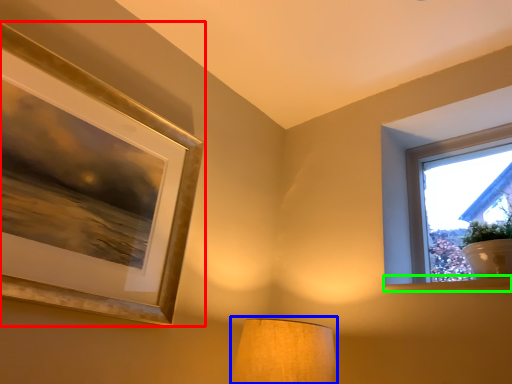
Question: Estimate the real-world distances between objects in this image. Which object is farther from picture frame (highlighted by a red box), lamp (highlighted by a blue box) or window sill (highlighted by a green box)?

Choices:
 (A) lamp
 (B) window sill

Answer: (B)